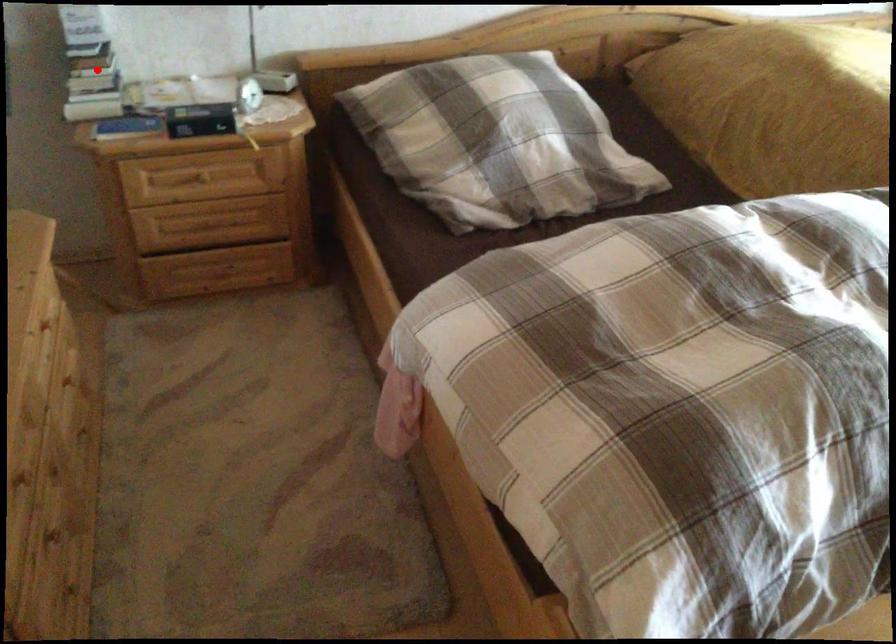
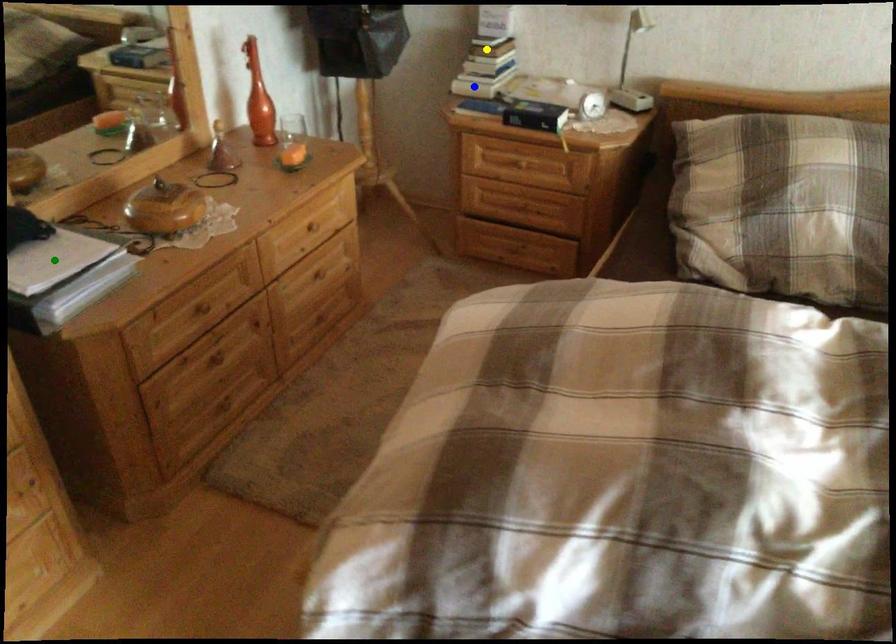
Question: I am providing you with two images of the same scene from different viewpoints. A red point is marked on the first image. You are given multiple points on the second image. Which point in image 2 is actually the same real-world point as the red point in image 1?

Choices:
 (A) blue point
 (B) yellow point
 (C) green point

Answer: (B)